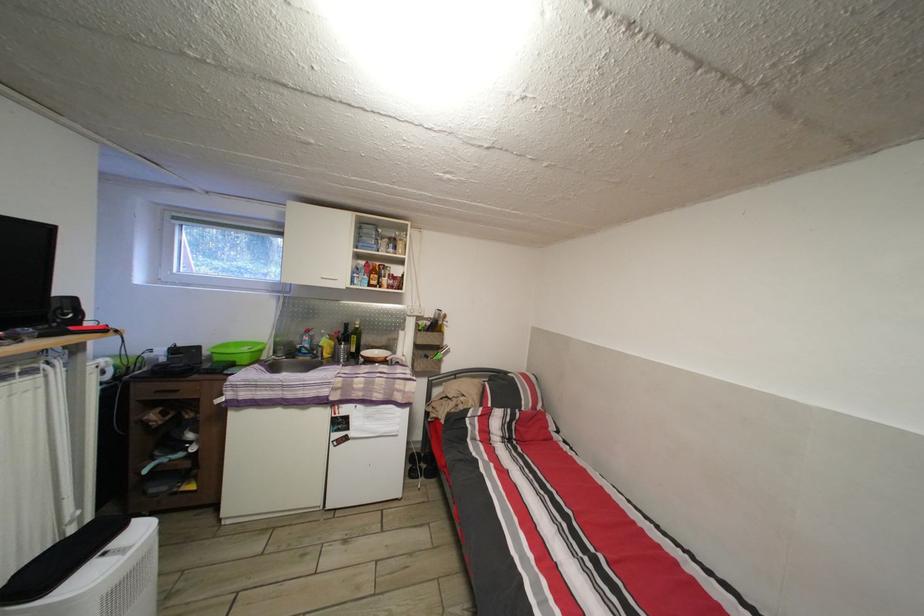
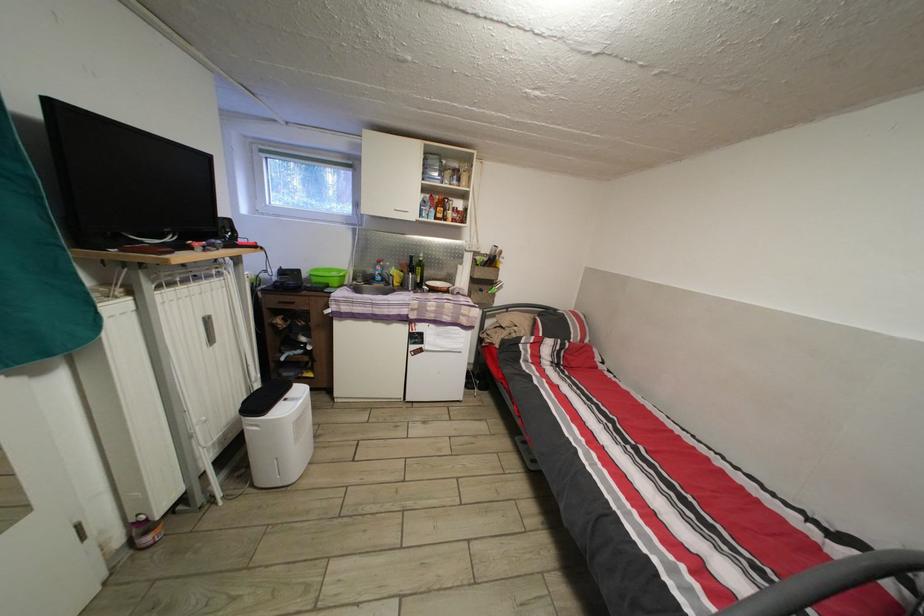
Where in the second image is the point corresponding to the point at 213,359 from the first image?

(311, 282)